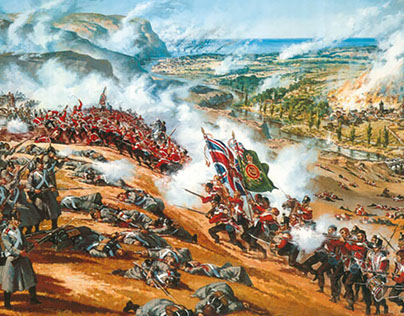
I want to click on painting, so click(x=370, y=33).